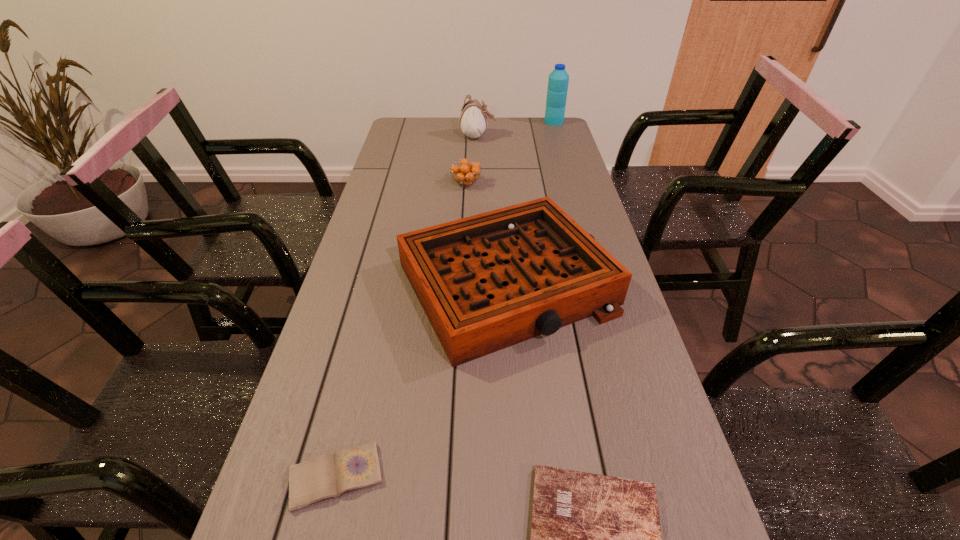
The width and height of the screenshot is (960, 540). I want to click on water bottle, so click(x=558, y=80).

Where is `the tallest object`? the tallest object is located at coordinates (558, 80).

Image resolution: width=960 pixels, height=540 pixels. In order to click on pouch in this screenshot , I will do `click(473, 122)`.

I want to click on the second tallest object, so click(473, 122).

Locate an element on the screen. This screenshot has width=960, height=540. the third tallest object is located at coordinates (486, 282).

At what (x,y) coordinates should I click in order to perform the action: click on gameboard. Please return your answer as a coordinate pair (x, y). Looking at the image, I should click on (486, 282).

You are a GUI agent. You are given a task and a screenshot of the screen. Output one action in this format:
    pyautogui.click(x=<x>, y=<y>)
    Task: Click on the orange fruit
    The image size is (960, 540).
    Given the screenshot: What is the action you would take?
    pyautogui.click(x=466, y=173)

The width and height of the screenshot is (960, 540). What are the coordinates of `the third shortest object` in the screenshot? It's located at (466, 173).

Where is `the second shortest object`? the second shortest object is located at coordinates (327, 476).

You are a GUI agent. You are given a task and a screenshot of the screen. Output one action in this format:
    pyautogui.click(x=<x>, y=<y>)
    Task: Click on the vacant space positioned on the front of the tallest object
    The width and height of the screenshot is (960, 540).
    Given the screenshot: What is the action you would take?
    pyautogui.click(x=564, y=155)